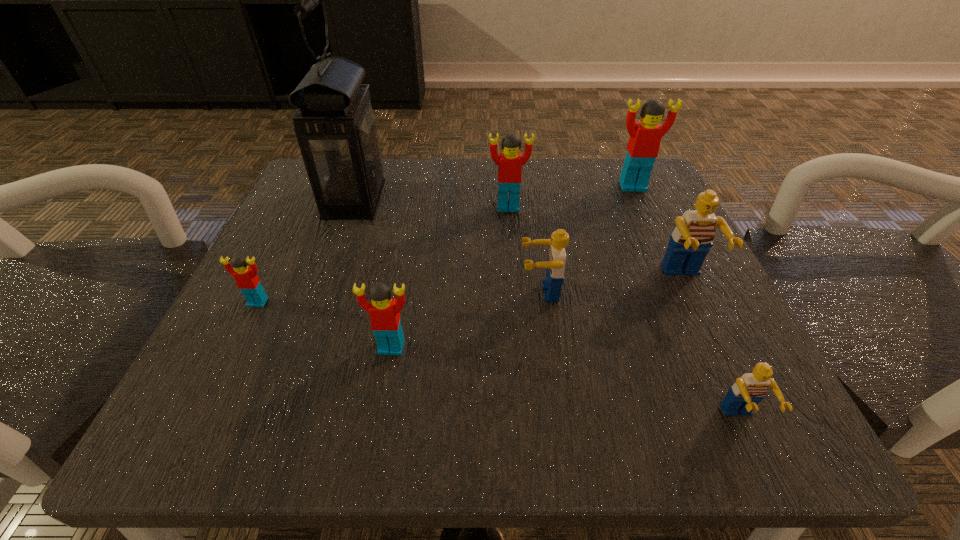
Locate an element on the screen. Image resolution: width=960 pixels, height=540 pixels. vacant region located on the face of the leftmost blue Lego is located at coordinates (489, 292).

Identify the location of free space located on the face of the leftmost blue Lego. (285, 292).

This screenshot has height=540, width=960. What are the coordinates of `vacant region located 0.180m on the face of the leftmost Lego` in the screenshot? It's located at (202, 416).

Locate an element on the screen. lantern that is positioned at the far edge is located at coordinates (336, 129).

This screenshot has height=540, width=960. I want to click on object located in the near edge section of the desktop, so click(x=748, y=390).

Find the location of a particular element. The height and width of the screenshot is (540, 960). lantern at the left edge is located at coordinates (336, 129).

I want to click on Lego positioned at the left edge, so 247,280.

What are the coordinates of `object that is at the far left corner` in the screenshot? It's located at (336, 129).

Where is `object situated at the far right corner`? The width and height of the screenshot is (960, 540). object situated at the far right corner is located at coordinates (645, 136).

Where is `object positioned at the near right corner`? This screenshot has height=540, width=960. object positioned at the near right corner is located at coordinates (748, 390).